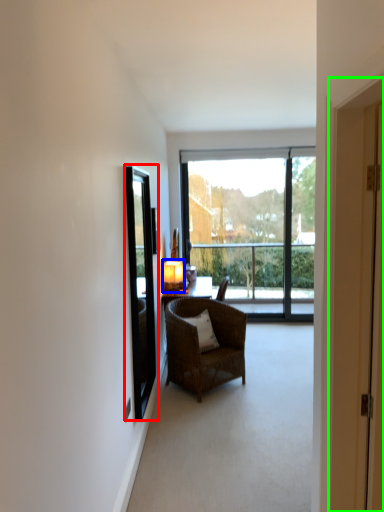
Question: Considering the real-world distances, which object is closest to window screen (highlighted by a red box)? light (highlighted by a blue box) or door (highlighted by a green box).

Choices:
 (A) light
 (B) door

Answer: (A)